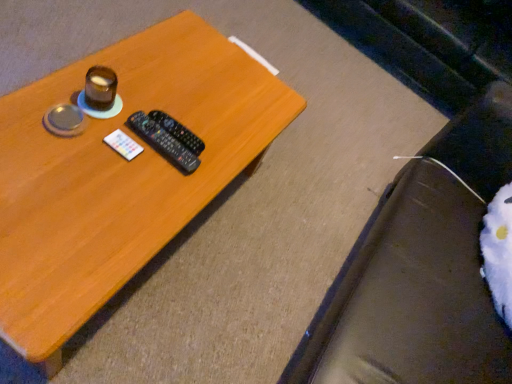
The width and height of the screenshot is (512, 384). I want to click on vacant space to the right of black plastic remote at center, which is the 1th remote control in front-to-back order, so click(203, 171).